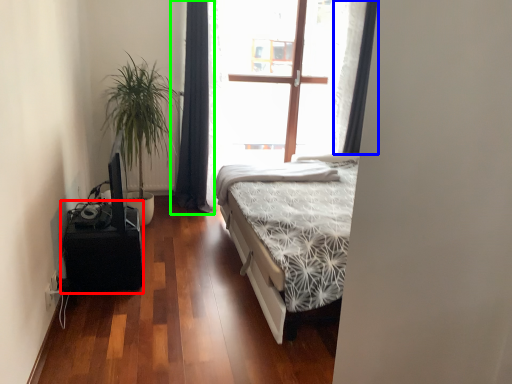
Question: Which object is positioned closest to table (highlighted by a red box)? Select from curtain (highlighted by a blue box) and curtain (highlighted by a green box).

Choices:
 (A) curtain
 (B) curtain

Answer: (B)